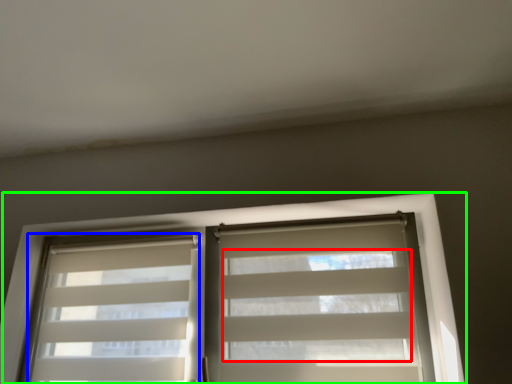
Question: Which object is positioned farthest from blind (highlighted by a red box)? Select from shutter (highlighted by a blue box) and window (highlighted by a green box).

Choices:
 (A) shutter
 (B) window

Answer: (A)